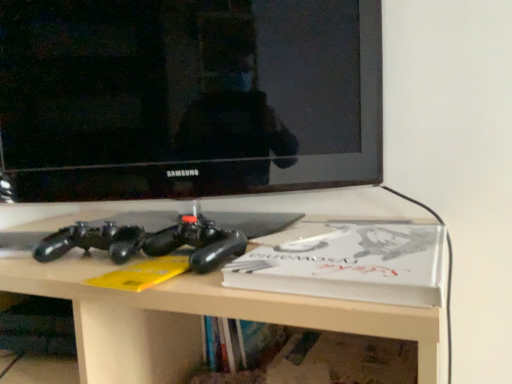
Question: Is white matte paperback book at center positioned far away from matte black controller at center?

Choices:
 (A) no
 (B) yes

Answer: (A)

Question: Could you tell me if white matte paperback book at center is facing matte black controller at center?

Choices:
 (A) no
 (B) yes

Answer: (A)

Question: Does white matte paperback book at center have a greater width compared to matte black controller at center?

Choices:
 (A) yes
 (B) no

Answer: (B)

Question: Considering the relative sizes of white matte paperback book at center and matte black controller at center in the image provided, is white matte paperback book at center shorter than matte black controller at center?

Choices:
 (A) no
 (B) yes

Answer: (B)

Question: Can you confirm if white matte paperback book at center is positioned to the right of matte black controller at center?

Choices:
 (A) no
 (B) yes

Answer: (B)

Question: Is white matte paperback book at center closer to the viewer compared to matte black controller at center?

Choices:
 (A) no
 (B) yes

Answer: (A)

Question: Does matte black controller at center have a greater height compared to black glossy television at upper center?

Choices:
 (A) no
 (B) yes

Answer: (B)

Question: From a real-world perspective, is matte black controller at center located higher than black glossy television at upper center?

Choices:
 (A) no
 (B) yes

Answer: (A)

Question: Does matte black controller at center come behind black glossy television at upper center?

Choices:
 (A) no
 (B) yes

Answer: (A)

Question: Is matte black controller at center completely or partially outside of black glossy television at upper center?

Choices:
 (A) yes
 (B) no

Answer: (A)

Question: Can you confirm if matte black controller at center is positioned to the right of black glossy television at upper center?

Choices:
 (A) no
 (B) yes

Answer: (A)

Question: Is matte black controller at center shorter than black glossy television at upper center?

Choices:
 (A) yes
 (B) no

Answer: (B)

Question: From a real-world perspective, is matte black controller at center on white matte paperback book at center?

Choices:
 (A) yes
 (B) no

Answer: (B)